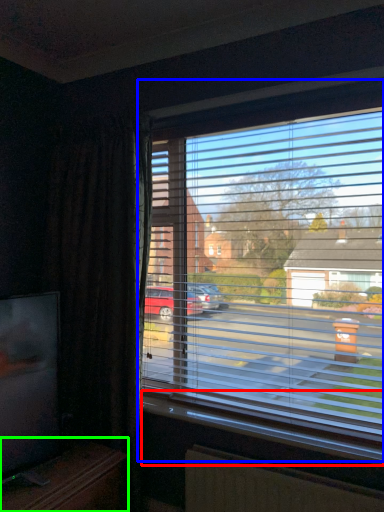
Question: Which object is positioned closest to window sill (highlighted by a red box)? Select from window (highlighted by a blue box) and entertainment center (highlighted by a green box).

Choices:
 (A) window
 (B) entertainment center

Answer: (A)